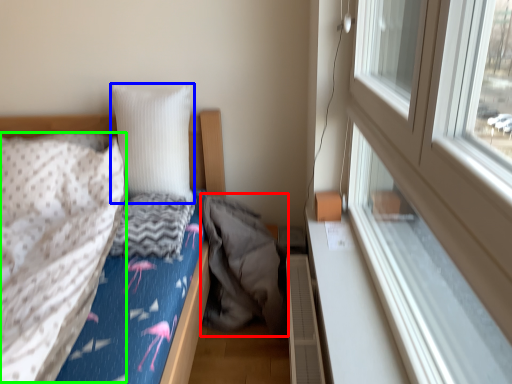
Question: Estimate the real-world distances between objects in this image. Which object is closer to sleeping bag (highlighted by a red box), pillow (highlighted by a blue box) or blanket (highlighted by a green box)?

Choices:
 (A) pillow
 (B) blanket

Answer: (A)